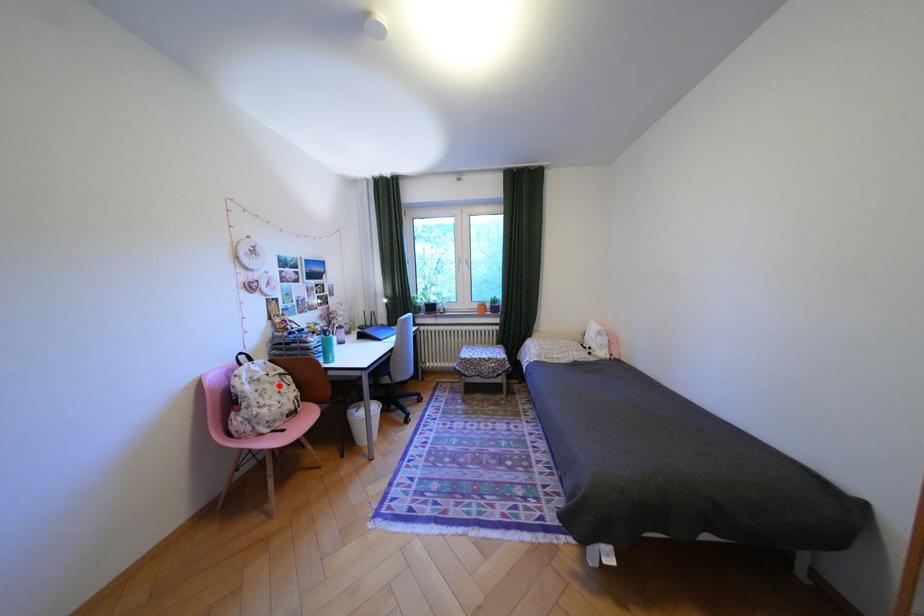
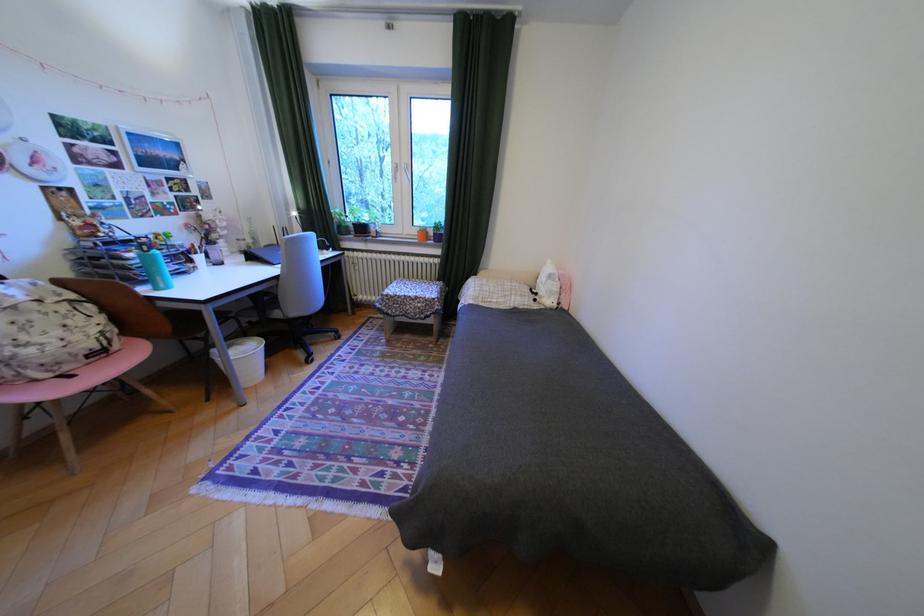
Question: I am providing you with two images of the same scene from different viewpoints. A red point is shown in image1. For the corresponding object point in image2, is it positioned nearer or farther from the camera?

Choices:
 (A) Nearer
 (B) Farther

Answer: (B)